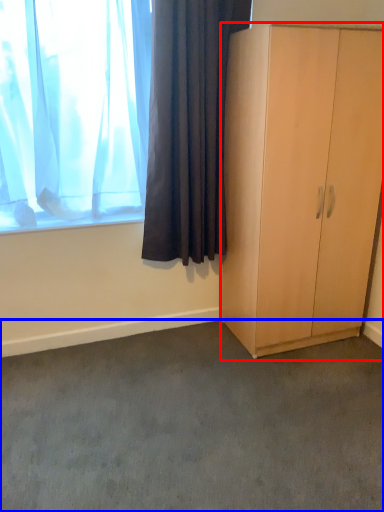
Question: Which object is further to the camera taking this photo, cabinetry (highlighted by a red box) or plain (highlighted by a blue box)?

Choices:
 (A) cabinetry
 (B) plain

Answer: (A)